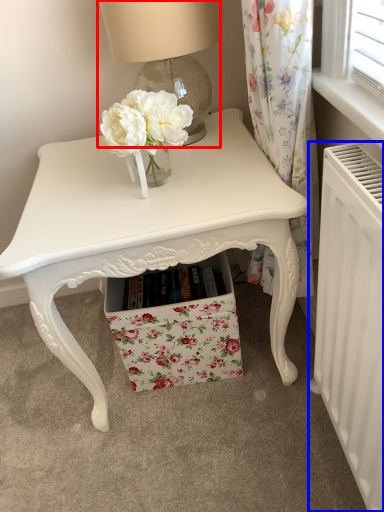
Question: Which object is further to the camera taking this photo, table lamp (highlighted by a red box) or radiator (highlighted by a blue box)?

Choices:
 (A) table lamp
 (B) radiator

Answer: (A)